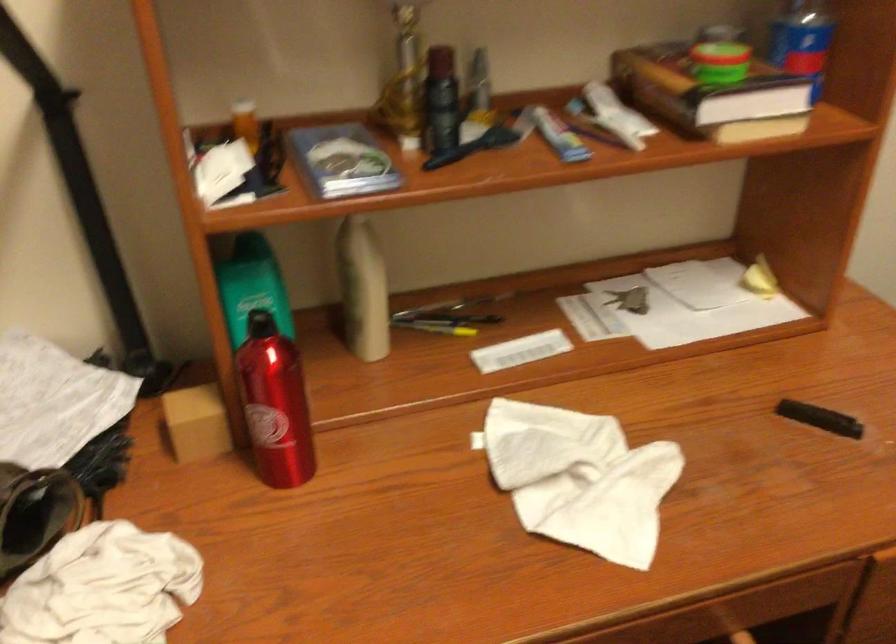
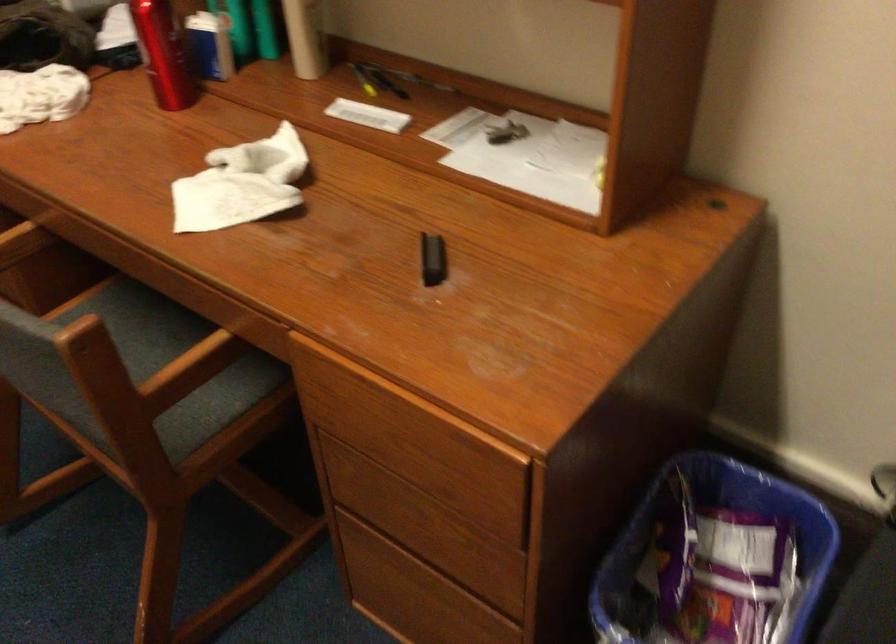
Question: I am providing you with two images of the same scene from different viewpoints. After the viewpoint changes to image2, which objects are now occluded?

Choices:
 (A) red water bottle
 (B) set of keys
 (C) blue trash can
 (D) none of these

Answer: (D)